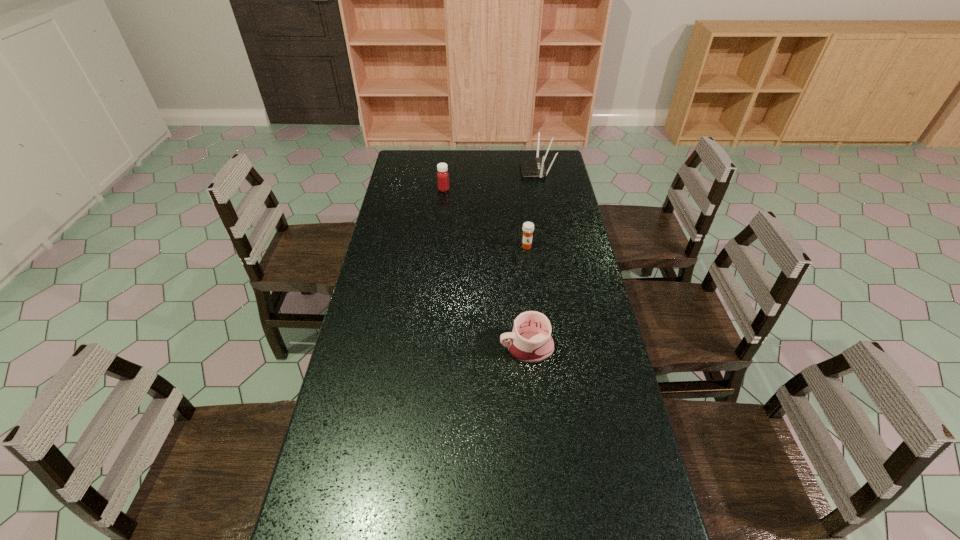
At what (x,y) coordinates should I click in order to perform the action: click on vacant space at the far left corner. Please return your answer as a coordinate pair (x, y). This screenshot has height=540, width=960. Looking at the image, I should click on [400, 169].

Locate an element on the screen. The height and width of the screenshot is (540, 960). free space between the third farthest object and the nearest object is located at coordinates (527, 297).

At what (x,y) coordinates should I click in order to perform the action: click on vacant area that lies between the router and the farther medicine. Please return your answer as a coordinate pair (x, y). The height and width of the screenshot is (540, 960). Looking at the image, I should click on (491, 179).

Identify the location of free point between the nearer medicine and the router. (532, 208).

Where is `empty location between the farther medicine and the second nearest object`? The height and width of the screenshot is (540, 960). empty location between the farther medicine and the second nearest object is located at coordinates (485, 218).

You are a GUI agent. You are given a task and a screenshot of the screen. Output one action in this format:
    pyautogui.click(x=<x>, y=<y>)
    Task: Click on the blank region between the leftmost object and the mug
    
    Given the screenshot: What is the action you would take?
    pyautogui.click(x=485, y=268)

The height and width of the screenshot is (540, 960). Identify the location of vacant area between the router and the leftmost object. (491, 179).

Identify the location of object that is the closest to the farthest object. (442, 175).

Locate which object is the second closest to the shorter medicine. Please provide its 2D coordinates. Your answer should be formatted as a tuple, i.e. [(x, y)], where the tuple contains the x and y coordinates of a point satisfying the conditions above.

[(530, 167)]

Identify the location of free spot that satisfies the following two spatial constraints: 1. on the label side of the nearer medicine; 2. on the side with the handle of the nearest object. pos(539,347).